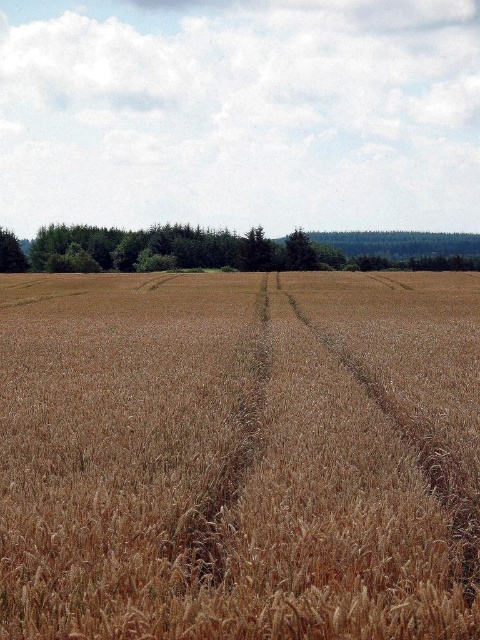
You are standing in the middle of the golden wheat field at center and want to walk towards the green leafy tree at left. Which direction should you head to reach the tree?

The green leafy tree at left is located to the left of the golden wheat field at center, so you should head left to reach it.